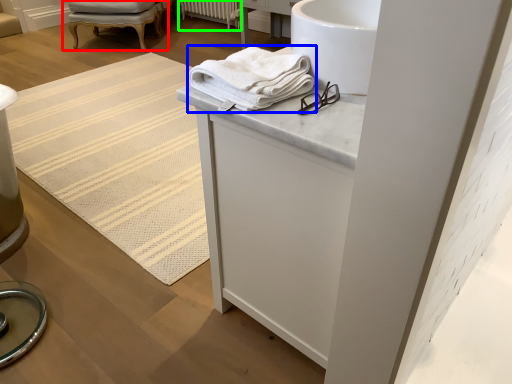
Question: Which object is positioned closest to chair (highlighted by a red box)? Select from towel (highlighted by a blue box) and radiator (highlighted by a green box).

Choices:
 (A) towel
 (B) radiator

Answer: (B)